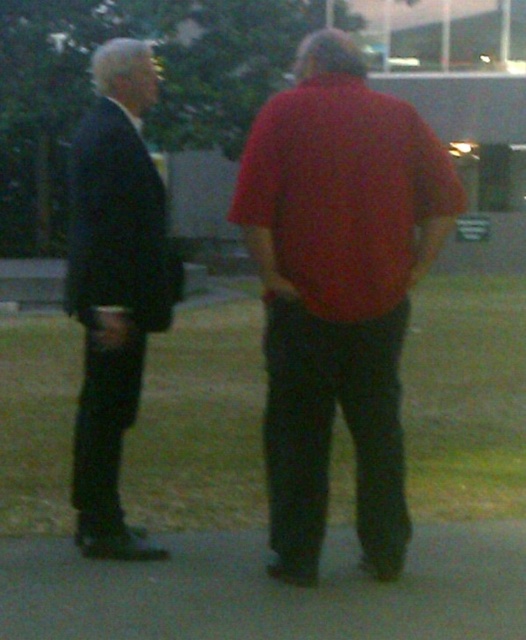
Question: Which of the following is the farthest from the observer?

Choices:
 (A) (274, 326)
 (B) (117, 497)

Answer: (B)

Question: Is matte red shirt at center above matte black suit at left?

Choices:
 (A) no
 (B) yes

Answer: (A)

Question: Does matte red shirt at center lie behind matte black suit at left?

Choices:
 (A) yes
 (B) no

Answer: (B)

Question: Which of the following is the farthest from the observer?

Choices:
 (A) (325, 152)
 (B) (98, 468)

Answer: (B)

Question: Does matte red shirt at center appear on the left side of matte black suit at left?

Choices:
 (A) yes
 (B) no

Answer: (B)